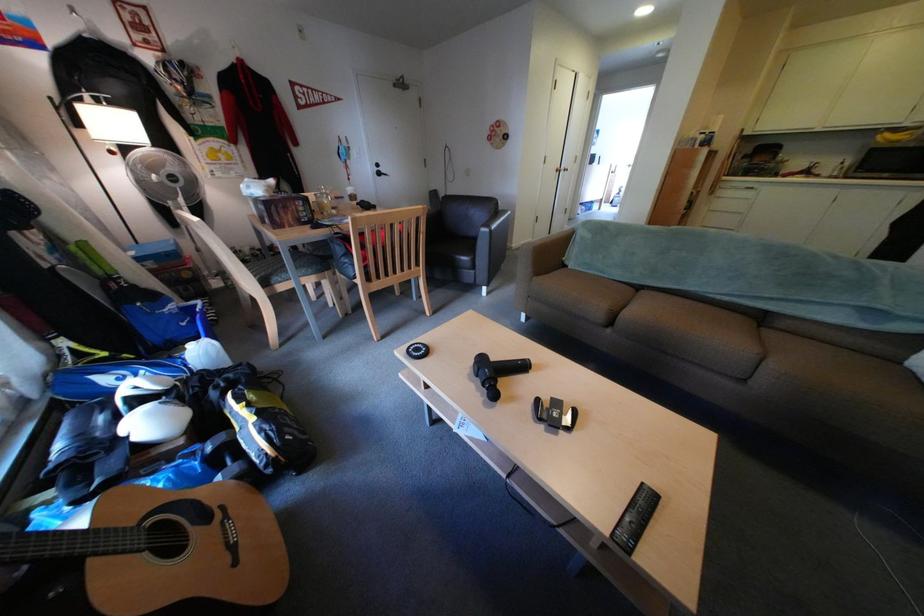
At what (x,y) coordinates should I click in order to perform the action: click on black massage gun. Please return your answer as a coordinate pair (x, y). Looking at the image, I should click on (496, 371).